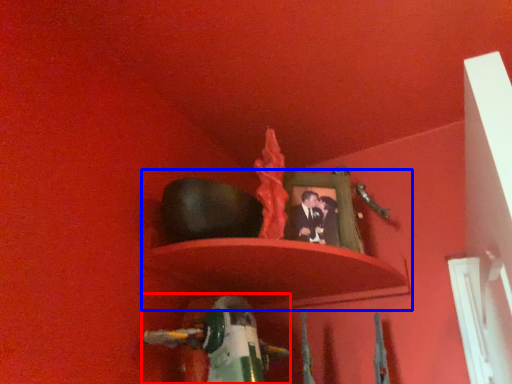
Question: Among these objects, which one is nearest to the camera, toy (highlighted by a red box) or shelf (highlighted by a blue box)?

Choices:
 (A) toy
 (B) shelf

Answer: (A)